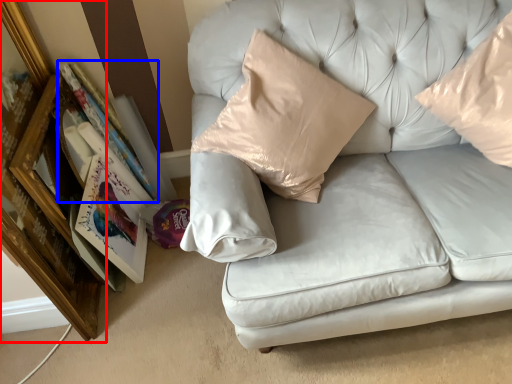
Question: Among these objects, which one is farthest to the camera, picture frame (highlighted by a red box) or book (highlighted by a blue box)?

Choices:
 (A) picture frame
 (B) book

Answer: (B)